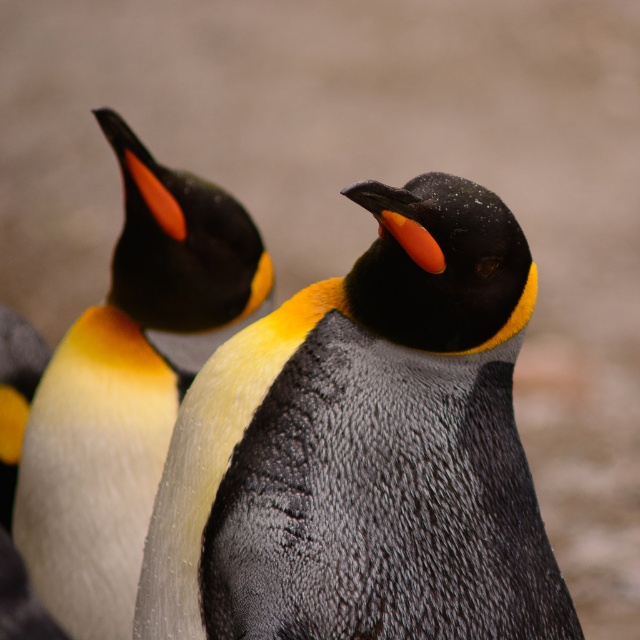
Question: Which object is positioned farthest from the matte black penguin at upper left?

Choices:
 (A) white fluffy penguin at left
 (B) textured gray penguin at center

Answer: (B)

Question: Does textured gray penguin at center appear on the right side of white fluffy penguin at left?

Choices:
 (A) no
 (B) yes

Answer: (B)

Question: Is textured gray penguin at center positioned at the back of white fluffy penguin at left?

Choices:
 (A) yes
 (B) no

Answer: (B)

Question: Where is textured gray penguin at center located in relation to white fluffy penguin at left in the image?

Choices:
 (A) below
 (B) above

Answer: (A)

Question: Which object appears farthest from the camera in this image?

Choices:
 (A) matte black penguin at upper left
 (B) white fluffy penguin at left

Answer: (B)

Question: Estimate the real-world distances between objects in this image. Which object is farther from the matte black penguin at upper left?

Choices:
 (A) textured gray penguin at center
 (B) white fluffy penguin at left

Answer: (A)